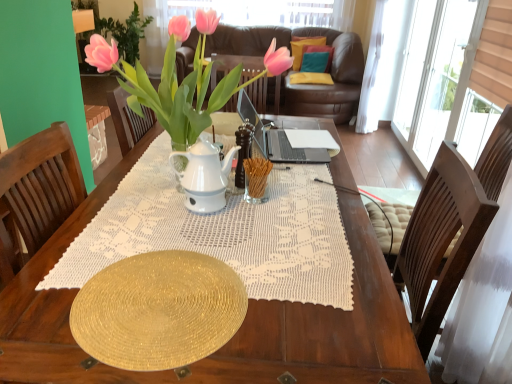
Question: Is yellow fabric pillow at center, positioned as the third pillow in top-to-bottom order, oriented towards velvet yellow pillow at upper center, which ranks as the 1th pillow in top-to-bottom order?

Choices:
 (A) yes
 (B) no

Answer: (B)

Question: Does yellow fabric pillow at center, positioned as the third pillow in top-to-bottom order, have a greater height compared to velvet yellow pillow at upper center, which ranks as the 1th pillow in top-to-bottom order?

Choices:
 (A) no
 (B) yes

Answer: (A)

Question: From the image's perspective, is yellow fabric pillow at center, marked as the first pillow in a bottom-to-top arrangement, below velvet yellow pillow at upper center, acting as the 3th pillow starting from the bottom?

Choices:
 (A) yes
 (B) no

Answer: (A)

Question: Does yellow fabric pillow at center, marked as the first pillow in a bottom-to-top arrangement, have a lesser height compared to velvet yellow pillow at upper center, which ranks as the 1th pillow in top-to-bottom order?

Choices:
 (A) yes
 (B) no

Answer: (A)

Question: Is velvet yellow pillow at upper center, acting as the 3th pillow starting from the bottom, surrounded by yellow fabric pillow at center, positioned as the third pillow in top-to-bottom order?

Choices:
 (A) yes
 (B) no

Answer: (B)

Question: Is pink glossy houseplant at upper center inside or outside of gold textured plate at center?

Choices:
 (A) inside
 (B) outside

Answer: (B)

Question: Based on their positions, is pink glossy houseplant at upper center located to the left or right of gold textured plate at center?

Choices:
 (A) left
 (B) right

Answer: (A)

Question: Is pink glossy houseplant at upper center wider or thinner than gold textured plate at center?

Choices:
 (A) thin
 (B) wide

Answer: (B)

Question: Considering the positions of pink glossy houseplant at upper center and gold textured plate at center in the image, is pink glossy houseplant at upper center taller or shorter than gold textured plate at center?

Choices:
 (A) tall
 (B) short

Answer: (A)

Question: Considering the positions of teal fabric pillow at upper center, arranged as the 2th pillow when viewed from the top, and velvet yellow pillow at upper center, acting as the 3th pillow starting from the bottom, in the image, is teal fabric pillow at upper center, arranged as the 2th pillow when viewed from the top, wider or thinner than velvet yellow pillow at upper center, acting as the 3th pillow starting from the bottom,?

Choices:
 (A) wide
 (B) thin

Answer: (B)

Question: From the image's perspective, is teal fabric pillow at upper center, the 2th pillow from the bottom, positioned above or below velvet yellow pillow at upper center, which ranks as the 1th pillow in top-to-bottom order?

Choices:
 (A) above
 (B) below

Answer: (B)

Question: From a real-world perspective, is teal fabric pillow at upper center, the 2th pillow from the bottom, above or below velvet yellow pillow at upper center, acting as the 3th pillow starting from the bottom?

Choices:
 (A) above
 (B) below

Answer: (B)

Question: Is point (322, 48) closer or farther from the camera than point (313, 39)?

Choices:
 (A) closer
 (B) farther

Answer: (B)

Question: Considering their positions, is yellow fabric pillow at center, positioned as the third pillow in top-to-bottom order, located in front of or behind teal fabric pillow at upper center, arranged as the 2th pillow when viewed from the top?

Choices:
 (A) behind
 (B) front

Answer: (B)

Question: Is yellow fabric pillow at center, positioned as the third pillow in top-to-bottom order, wider or thinner than teal fabric pillow at upper center, arranged as the 2th pillow when viewed from the top?

Choices:
 (A) thin
 (B) wide

Answer: (B)